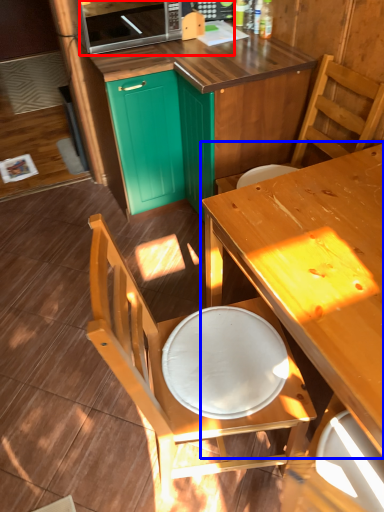
Question: Which object appears farthest to the camera in this image, microwave oven (highlighted by a red box) or table (highlighted by a blue box)?

Choices:
 (A) microwave oven
 (B) table

Answer: (A)